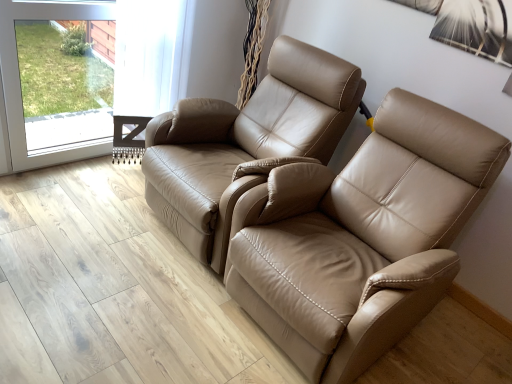
Identify the location of vacant space situated on the left part of tan leather recliner at center, the second chair in the left-to-right sequence. (128, 303).